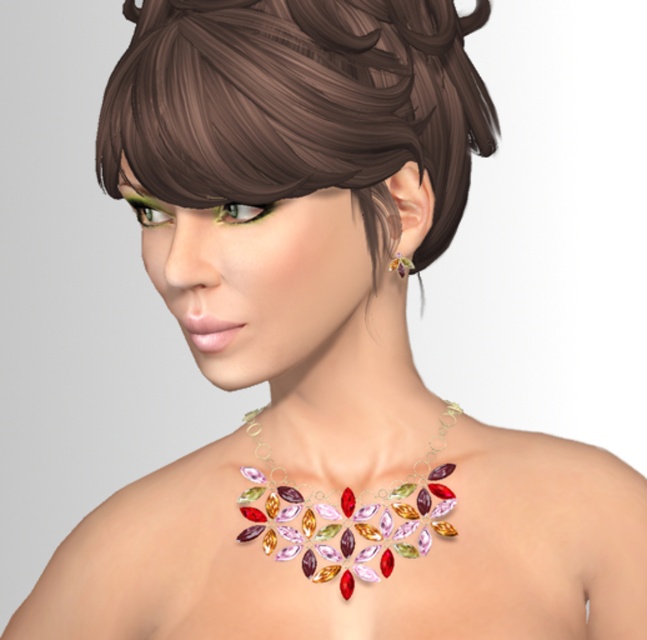
Which of these two, multicolored gemstone necklace at center or shiny gold earring at ear, stands taller?

multicolored gemstone necklace at center is taller.

Between multicolored gemstone necklace at center and shiny gold earring at ear, which one is positioned lower?

multicolored gemstone necklace at center

Describe the element at coordinates (345, 515) in the screenshot. I see `multicolored gemstone necklace at center` at that location.

Locate an element on the screen. multicolored gemstone necklace at center is located at coordinates (345, 515).